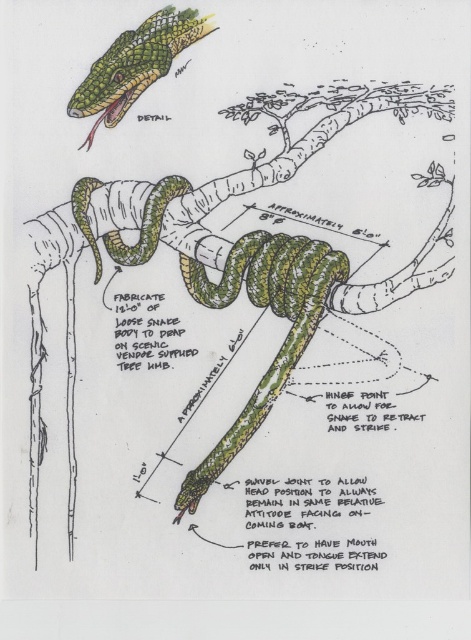
You are an artist trying to replicate the snake illustration. According to the provided image, where should you position the green scaly snake at center in terms of coordinates?

The green scaly snake at center should be positioned at coordinates point (273,312) as specified in the illustration.

You are an artist trying to paint the green scaly snake at center accurately. You need to know how far you should stand from the snake to capture its full body in your canvas. According to the drawing instructions, what is the recommended distance?

The recommended distance to stand from the green scaly snake at center is 3.67 feet, as this ensures the snake is fully visible on the canvas without any parts being cut off.